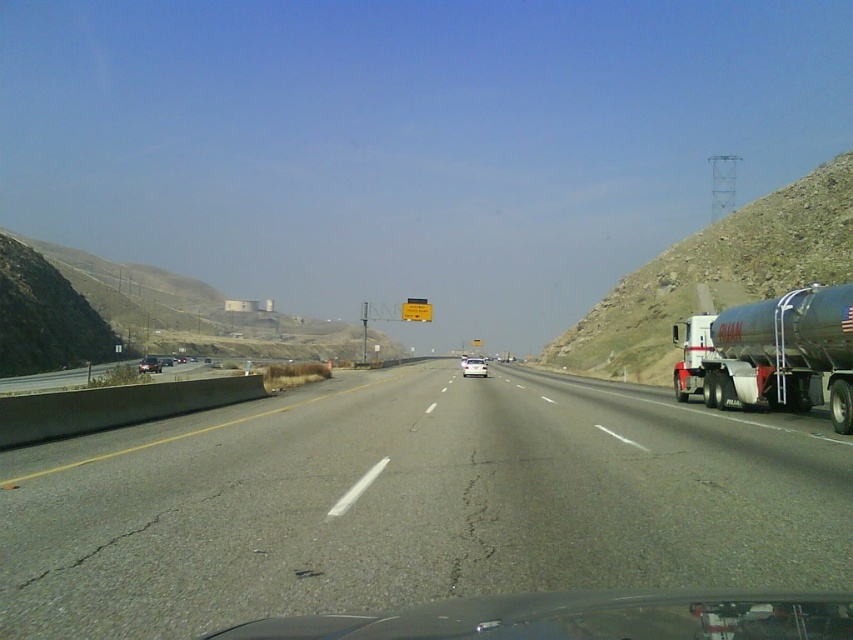
Question: Is the position of asphalt road at center less distant than that of white matte van at center?

Choices:
 (A) no
 (B) yes

Answer: (B)

Question: Can you confirm if asphalt road at center is positioned above metallic silver sedan at center?

Choices:
 (A) no
 (B) yes

Answer: (B)

Question: Among these objects, which one is farthest from the camera?

Choices:
 (A) metallic silver sedan at center
 (B) white matte van at center
 (C) metallic silver tanker at right

Answer: (A)

Question: Which of the following is the closest to the observer?

Choices:
 (A) white matte van at center
 (B) metallic silver sedan at center

Answer: (A)

Question: Considering the real-world distances, which object is closest to the metallic silver sedan at center?

Choices:
 (A) white matte van at center
 (B) transparent glass windshield at lower center
 (C) asphalt road at center

Answer: (A)

Question: Does asphalt road at center have a greater width compared to metallic silver sedan at center?

Choices:
 (A) yes
 (B) no

Answer: (A)